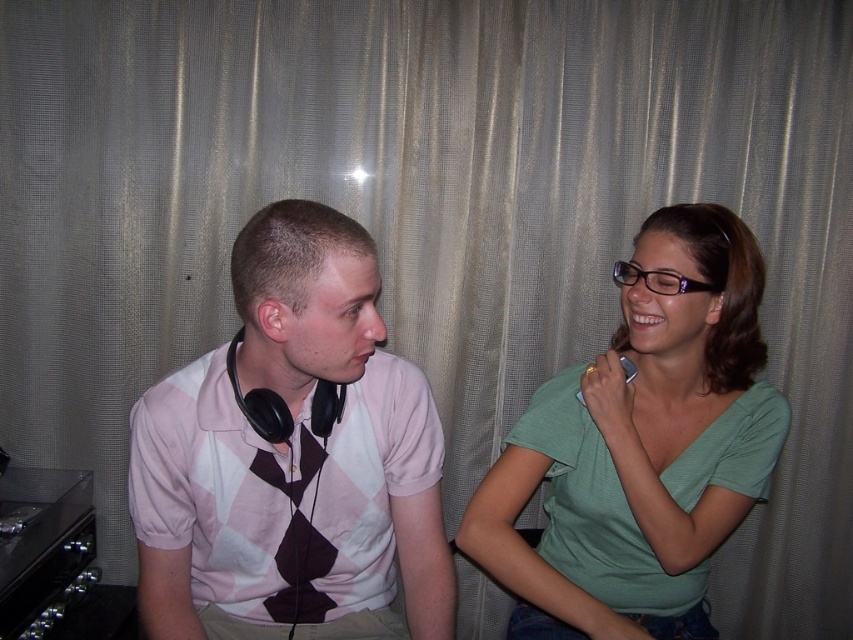
Is pink argyle shirt at center smaller than green matte shirt at right?

Yes, pink argyle shirt at center is smaller than green matte shirt at right.

Can you confirm if pink argyle shirt at center is bigger than green matte shirt at right?

No, pink argyle shirt at center is not bigger than green matte shirt at right.

Between point (367, 490) and point (703, 376), which one is positioned in front?

Positioned in front is point (367, 490).

In order to click on pink argyle shirt at center in this screenshot , I will do `click(292, 460)`.